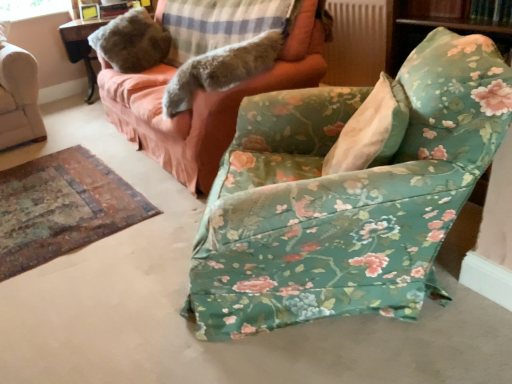
Image resolution: width=512 pixels, height=384 pixels. In order to click on fluffy gray fur at upper center in this screenshot , I will do `click(221, 70)`.

Image resolution: width=512 pixels, height=384 pixels. In order to click on fluffy gray pillow at upper center, arranged as the second pillow when viewed from the front in this screenshot , I will do [x=221, y=23].

The width and height of the screenshot is (512, 384). Find the location of `white fabric pillow at center, acting as the first pillow starting from the front`. white fabric pillow at center, acting as the first pillow starting from the front is located at coordinates (371, 130).

The height and width of the screenshot is (384, 512). What do you see at coordinates (345, 196) in the screenshot? I see `floral fabric chair at center` at bounding box center [345, 196].

Identify the location of floral fabric couch at upper center. The image size is (512, 384). (205, 104).

From a real-world perspective, is fluffy gray fur at upper center positioned above or below floral fabric chair at center?

From a real-world perspective, fluffy gray fur at upper center is physically above floral fabric chair at center.

Is fluffy gray fur at upper center bigger than floral fabric chair at center?

No, fluffy gray fur at upper center is not bigger than floral fabric chair at center.

Is fluffy gray fur at upper center to the left or to the right of floral fabric chair at center in the image?

fluffy gray fur at upper center is positioned on floral fabric chair at center's left side.

Consider the image. Is fluffy gray fur at upper center positioned behind floral fabric chair at center?

Yes, it is behind floral fabric chair at center.

From a real-world perspective, is floral fabric chair at center on fuzzy fabric pillow at upper left, marked as the 1th pillow in a back-to-front arrangement?

No, from a real-world perspective, floral fabric chair at center is not on top of fuzzy fabric pillow at upper left, marked as the 1th pillow in a back-to-front arrangement.

Is floral fabric chair at center in contact with fuzzy fabric pillow at upper left, marked as the 1th pillow in a back-to-front arrangement?

No, floral fabric chair at center is not in contact with fuzzy fabric pillow at upper left, marked as the 1th pillow in a back-to-front arrangement.

Which of these two, floral fabric chair at center or fuzzy fabric pillow at upper left, placed as the third pillow when sorted from front to back, is smaller?

fuzzy fabric pillow at upper left, placed as the third pillow when sorted from front to back.

At what (x,y) coordinates should I click in order to perform the action: click on window screen behind the fluffy gray pillow at upper center, arranged as the second pillow when viewed from the front. Please return your answer as a coordinate pair (x, y). Looking at the image, I should click on (31, 8).

Can you confirm if fluffy gray pillow at upper center, positioned as the 2th pillow in back-to-front order, is shorter than clear glass window screen at upper left?

No, fluffy gray pillow at upper center, positioned as the 2th pillow in back-to-front order, is not shorter than clear glass window screen at upper left.

Does point (220, 22) appear closer or farther from the camera than point (6, 12)?

Point (220, 22) appears to be closer to the viewer than point (6, 12).

Is white fabric pillow at center, the 3th pillow viewed from the back, to the right of fluffy gray pillow at upper center, positioned as the 2th pillow in back-to-front order, from the viewer's perspective?

Correct, you'll find white fabric pillow at center, the 3th pillow viewed from the back, to the right of fluffy gray pillow at upper center, positioned as the 2th pillow in back-to-front order.

Is white fabric pillow at center, acting as the first pillow starting from the front, oriented away from fluffy gray pillow at upper center, positioned as the 2th pillow in back-to-front order?

white fabric pillow at center, acting as the first pillow starting from the front, does not have its back to fluffy gray pillow at upper center, positioned as the 2th pillow in back-to-front order.

In terms of height, does white fabric pillow at center, the 3th pillow viewed from the back, look taller or shorter compared to fluffy gray pillow at upper center, positioned as the 2th pillow in back-to-front order?

Clearly, white fabric pillow at center, the 3th pillow viewed from the back, is shorter compared to fluffy gray pillow at upper center, positioned as the 2th pillow in back-to-front order.

Consider the image. Is white fabric pillow at center, the 3th pillow viewed from the back, bigger or smaller than fluffy gray pillow at upper center, arranged as the second pillow when viewed from the front?

Considering their sizes, white fabric pillow at center, the 3th pillow viewed from the back, takes up less space than fluffy gray pillow at upper center, arranged as the second pillow when viewed from the front.

Which object is positioned more to the right, floral fabric chair at center or floral fabric couch at upper center?

floral fabric chair at center is more to the right.

Is floral fabric chair at center facing away from floral fabric couch at upper center?

No, floral fabric chair at center is not facing the opposite direction of floral fabric couch at upper center.

How many degrees apart are the facing directions of floral fabric chair at center and floral fabric couch at upper center?

The facing directions of floral fabric chair at center and floral fabric couch at upper center are 39.2 degrees apart.

From the image's perspective, which object appears higher, floral fabric chair at center or floral fabric couch at upper center?

floral fabric couch at upper center appears higher in the image.

Considering the sizes of objects white fabric pillow at center, acting as the first pillow starting from the front, and clear glass window screen at upper left in the image provided, who is taller, white fabric pillow at center, acting as the first pillow starting from the front, or clear glass window screen at upper left?

Standing taller between the two is white fabric pillow at center, acting as the first pillow starting from the front.

Between white fabric pillow at center, the 3th pillow viewed from the back, and clear glass window screen at upper left, which one has larger size?

With larger size is white fabric pillow at center, the 3th pillow viewed from the back.

Which is further, (375,146) or (33,12)?

Positioned behind is point (33,12).

Identify the location of the 1st pillow located above the white fabric pillow at center, acting as the first pillow starting from the front (from a real-world perspective). (132, 42).

Is fuzzy fabric pillow at upper left, placed as the third pillow when sorted from front to back, at the back of white fabric pillow at center, acting as the first pillow starting from the front?

No, white fabric pillow at center, acting as the first pillow starting from the front,'s orientation is not away from fuzzy fabric pillow at upper left, placed as the third pillow when sorted from front to back.

From a real-world perspective, is white fabric pillow at center, acting as the first pillow starting from the front, positioned above or below fuzzy fabric pillow at upper left, marked as the 1th pillow in a back-to-front arrangement?

In terms of real-world spatial position, white fabric pillow at center, acting as the first pillow starting from the front, is below fuzzy fabric pillow at upper left, marked as the 1th pillow in a back-to-front arrangement.

Is white fabric pillow at center, acting as the first pillow starting from the front, bigger or smaller than fuzzy fabric pillow at upper left, placed as the third pillow when sorted from front to back?

In the image, white fabric pillow at center, acting as the first pillow starting from the front, appears to be smaller than fuzzy fabric pillow at upper left, placed as the third pillow when sorted from front to back.

At what (x,y) coordinates should I click in order to perform the action: click on animal that appears above the floral fabric chair at center (from a real-world perspective). Please return your answer as a coordinate pair (x, y). This screenshot has height=384, width=512. Looking at the image, I should click on (221, 70).

Locate an element on the screen. The width and height of the screenshot is (512, 384). chair in front of the fuzzy fabric pillow at upper left, marked as the 1th pillow in a back-to-front arrangement is located at coordinates (345, 196).

From the image, which object appears to be farther from clear glass window screen at upper left, fluffy gray pillow at upper center, arranged as the second pillow when viewed from the front, or fuzzy fabric pillow at upper left, marked as the 1th pillow in a back-to-front arrangement?

Among the two, fluffy gray pillow at upper center, arranged as the second pillow when viewed from the front, is located further to clear glass window screen at upper left.

Based on their spatial positions, is fuzzy fabric pillow at upper left, marked as the 1th pillow in a back-to-front arrangement, or fluffy gray pillow at upper center, positioned as the 2th pillow in back-to-front order, closer to floral fabric chair at center?

The object closer to floral fabric chair at center is fluffy gray pillow at upper center, positioned as the 2th pillow in back-to-front order.

Considering their positions, is white fabric pillow at center, acting as the first pillow starting from the front, positioned further to fuzzy fabric pillow at upper left, marked as the 1th pillow in a back-to-front arrangement, than floral fabric couch at upper center?

Based on the image, white fabric pillow at center, acting as the first pillow starting from the front, appears to be further to fuzzy fabric pillow at upper left, marked as the 1th pillow in a back-to-front arrangement.

Considering their positions, is floral fabric couch at upper center positioned further to fluffy gray fur at upper center than fuzzy fabric pillow at upper left, placed as the third pillow when sorted from front to back?

Based on the image, fuzzy fabric pillow at upper left, placed as the third pillow when sorted from front to back, appears to be further to fluffy gray fur at upper center.

When comparing their distances from fluffy gray pillow at upper center, positioned as the 2th pillow in back-to-front order, does white fabric pillow at center, acting as the first pillow starting from the front, or clear glass window screen at upper left seem further?

The object further to fluffy gray pillow at upper center, positioned as the 2th pillow in back-to-front order, is clear glass window screen at upper left.

Considering their positions, is fluffy gray pillow at upper center, arranged as the second pillow when viewed from the front, positioned closer to fluffy gray fur at upper center than fuzzy fabric pillow at upper left, placed as the third pillow when sorted from front to back?

fluffy gray pillow at upper center, arranged as the second pillow when viewed from the front, is closer to fluffy gray fur at upper center.

Looking at this image, when comparing their distances from clear glass window screen at upper left, does fluffy gray fur at upper center or floral fabric couch at upper center seem closer?

floral fabric couch at upper center is closer to clear glass window screen at upper left.

Estimate the real-world distances between objects in this image. Which object is further from fluffy gray pillow at upper center, arranged as the second pillow when viewed from the front, fuzzy fabric pillow at upper left, placed as the third pillow when sorted from front to back, or floral fabric couch at upper center?

floral fabric couch at upper center lies further to fluffy gray pillow at upper center, arranged as the second pillow when viewed from the front, than the other object.

Find the location of a particular element. studio couch between floral fabric chair at center and fluffy gray fur at upper center in the front-back direction is located at coordinates (205, 104).

You are a GUI agent. You are given a task and a screenshot of the screen. Output one action in this format:
    pyautogui.click(x=<x>, y=<y>)
    Task: Click on the animal positioned between white fabric pillow at center, acting as the first pillow starting from the front, and fuzzy fabric pillow at upper left, marked as the 1th pillow in a back-to-front arrangement, from near to far
    The image size is (512, 384).
    Given the screenshot: What is the action you would take?
    pyautogui.click(x=221, y=70)

Locate an element on the screen. pillow located between fluffy gray fur at upper center and fuzzy fabric pillow at upper left, placed as the third pillow when sorted from front to back, in the depth direction is located at coordinates (221, 23).

The width and height of the screenshot is (512, 384). Identify the location of pillow between floral fabric couch at upper center and fuzzy fabric pillow at upper left, marked as the 1th pillow in a back-to-front arrangement, along the z-axis. (221, 23).